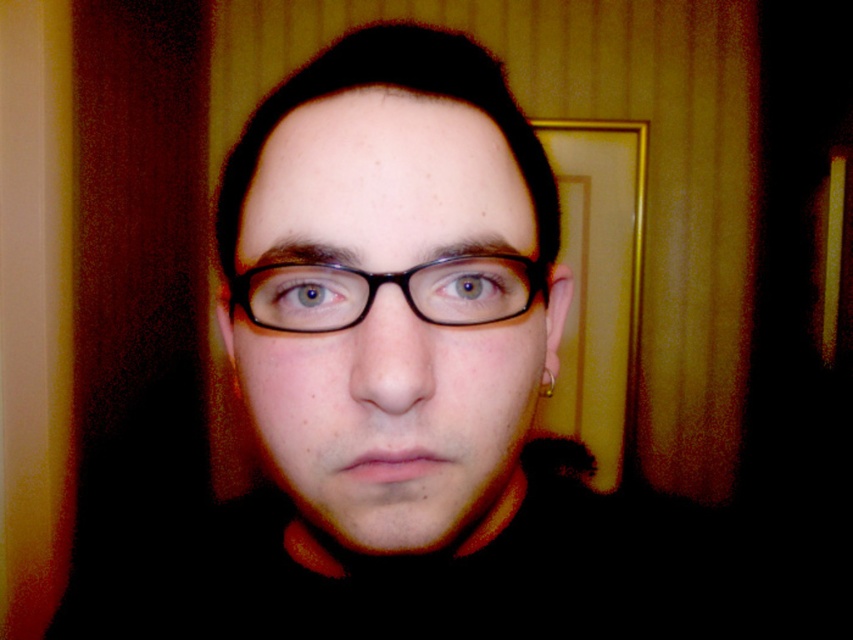
Question: Is brown matte eye at center above blue glossy eye at center?

Choices:
 (A) no
 (B) yes

Answer: (B)

Question: Is black plastic glasses at center below brown matte eye at center?

Choices:
 (A) yes
 (B) no

Answer: (B)

Question: Is black plastic glasses at center smaller than blue glossy eye at center?

Choices:
 (A) yes
 (B) no

Answer: (B)

Question: Which point is closer to the camera?

Choices:
 (A) (289, 275)
 (B) (248, 291)

Answer: (A)

Question: Among these points, which one is nearest to the camera?

Choices:
 (A) (398, 330)
 (B) (331, 304)
 (C) (480, 260)

Answer: (A)

Question: Which object appears closest to the camera in this image?

Choices:
 (A) brown matte eye at center
 (B) blue glossy eye at center
 (C) black plastic glasses at center

Answer: (C)